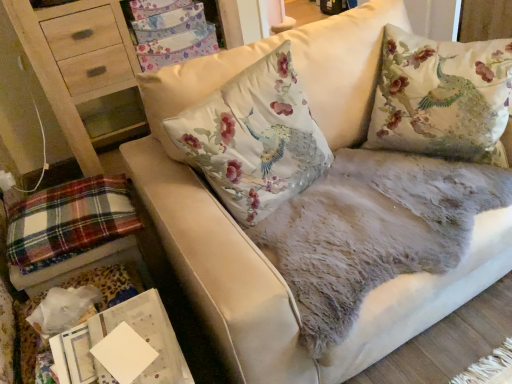
At what (x,y) coordinates should I click in order to perform the action: click on floral fabric cushion at upper right. Please return your answer as a coordinate pair (x, y). Looking at the image, I should click on (81, 72).

The height and width of the screenshot is (384, 512). What do you see at coordinates (442, 97) in the screenshot?
I see `silky floral pillow at upper right, the first pillow positioned from the right` at bounding box center [442, 97].

Image resolution: width=512 pixels, height=384 pixels. I want to click on floral fabric cushion at center, positioned as the second pillow in right-to-left order, so click(255, 138).

Where is `floral fabric cushion at upper right`? This screenshot has width=512, height=384. floral fabric cushion at upper right is located at coordinates (81, 72).

Measure the distance from silky floral pillow at upper right, the 2th pillow when ordered from left to right, to white paper at lower left.

silky floral pillow at upper right, the 2th pillow when ordered from left to right, is 1.05 meters from white paper at lower left.

Can you tell me how much silky floral pillow at upper right, the 2th pillow when ordered from left to right, and white paper at lower left differ in facing direction?

There is a 150-degree angle between the facing directions of silky floral pillow at upper right, the 2th pillow when ordered from left to right, and white paper at lower left.

Based on the photo, looking at their sizes, would you say silky floral pillow at upper right, the 2th pillow when ordered from left to right, is wider or thinner than white paper at lower left?

silky floral pillow at upper right, the 2th pillow when ordered from left to right, is wider than white paper at lower left.

Considering the positions of points (426, 63) and (166, 343), is point (426, 63) closer to camera compared to point (166, 343)?

No, it is behind (166, 343).

Does plaid fabric at lower left turn towards silky floral pillow at upper right, the 2th pillow when ordered from left to right?

Yes, plaid fabric at lower left is facing silky floral pillow at upper right, the 2th pillow when ordered from left to right.

From a real-world perspective, is plaid fabric at lower left positioned over silky floral pillow at upper right, the first pillow positioned from the right, based on gravity?

No.

Between plaid fabric at lower left and silky floral pillow at upper right, the first pillow positioned from the right, which one appears on the left side from the viewer's perspective?

plaid fabric at lower left is more to the left.

How much distance is there between plaid fabric at lower left and silky floral pillow at upper right, the first pillow positioned from the right?

plaid fabric at lower left and silky floral pillow at upper right, the first pillow positioned from the right, are 3.49 feet apart from each other.

Consider the image. Considering the sizes of floral fabric cushion at upper right and plaid fabric at lower left in the image, is floral fabric cushion at upper right wider or thinner than plaid fabric at lower left?

In the image, floral fabric cushion at upper right appears to be more narrow than plaid fabric at lower left.

Is floral fabric cushion at upper right next to plaid fabric at lower left?

floral fabric cushion at upper right and plaid fabric at lower left are clearly separated.

Is floral fabric cushion at upper right facing away from plaid fabric at lower left?

floral fabric cushion at upper right is not turned away from plaid fabric at lower left.

Can we say plaid fabric at lower left lies outside white paper at lower left?

That's correct, plaid fabric at lower left is outside of white paper at lower left.

Which of these two, plaid fabric at lower left or white paper at lower left, is bigger?

plaid fabric at lower left is bigger.

Would you consider plaid fabric at lower left to be distant from white paper at lower left?

That's not correct — plaid fabric at lower left is a little close to white paper at lower left.

How distant is floral fabric cushion at center, the 1th pillow when ordered from left to right, from silky floral pillow at upper right, the 2th pillow when ordered from left to right?

They are 17.19 inches apart.

From the picture: Which of these two, floral fabric cushion at center, positioned as the second pillow in right-to-left order, or silky floral pillow at upper right, the first pillow positioned from the right, is wider?

Wider between the two is silky floral pillow at upper right, the first pillow positioned from the right.

From the image's perspective, is floral fabric cushion at center, the 1th pillow when ordered from left to right, beneath silky floral pillow at upper right, the first pillow positioned from the right?

Indeed, from the image's perspective, floral fabric cushion at center, the 1th pillow when ordered from left to right, is shown beneath silky floral pillow at upper right, the first pillow positioned from the right.

Based on the photo, which is more to the left, floral fabric cushion at center, positioned as the second pillow in right-to-left order, or silky floral pillow at upper right, the first pillow positioned from the right?

floral fabric cushion at center, positioned as the second pillow in right-to-left order.

Is silky floral pillow at upper right, the 2th pillow when ordered from left to right, aimed at floral fabric cushion at upper right?

No, silky floral pillow at upper right, the 2th pillow when ordered from left to right, does not turn towards floral fabric cushion at upper right.

Between silky floral pillow at upper right, the 2th pillow when ordered from left to right, and floral fabric cushion at upper right, which one appears on the left side from the viewer's perspective?

floral fabric cushion at upper right is more to the left.

Measure the distance from silky floral pillow at upper right, the first pillow positioned from the right, to floral fabric cushion at upper right.

They are 4.64 feet apart.

Is silky floral pillow at upper right, the 2th pillow when ordered from left to right, closer to camera compared to floral fabric cushion at upper right?

Yes, the depth of silky floral pillow at upper right, the 2th pillow when ordered from left to right, is less than that of floral fabric cushion at upper right.

In the scene shown: Which object is thinner, floral fabric cushion at upper right or white paper at lower left?

white paper at lower left is thinner.

What's the angular difference between floral fabric cushion at upper right and white paper at lower left's facing directions?

The angular difference between floral fabric cushion at upper right and white paper at lower left is 90.2 degrees.

Is there a large distance between floral fabric cushion at upper right and white paper at lower left?

Yes, floral fabric cushion at upper right is far from white paper at lower left.

From a real-world perspective, is floral fabric cushion at upper right under white paper at lower left?

No.

At what (x,y) coordinates should I click in order to perform the action: click on pillow that is the 2nd object to the right of the white paper at lower left, starting at the anchor. Please return your answer as a coordinate pair (x, y). Image resolution: width=512 pixels, height=384 pixels. Looking at the image, I should click on (442, 97).

From the image's perspective, starting from the plaid fabric at lower left, which pillow is the 2nd one above? Please provide its 2D coordinates.

[(442, 97)]

Based on their spatial positions, is plaid fabric at lower left or floral fabric cushion at upper right closer to floral fabric cushion at center, the 1th pillow when ordered from left to right?

plaid fabric at lower left lies closer to floral fabric cushion at center, the 1th pillow when ordered from left to right, than the other object.

Considering their positions, is plaid fabric at lower left positioned further to white paper at lower left than floral fabric cushion at upper right?

floral fabric cushion at upper right is positioned further to the anchor white paper at lower left.

Based on their spatial positions, is floral fabric cushion at center, positioned as the second pillow in right-to-left order, or silky floral pillow at upper right, the 2th pillow when ordered from left to right, closer to white paper at lower left?

floral fabric cushion at center, positioned as the second pillow in right-to-left order, is closer to white paper at lower left.

When comparing their distances from white paper at lower left, does silky floral pillow at upper right, the first pillow positioned from the right, or floral fabric cushion at upper right seem further?

Among the two, floral fabric cushion at upper right is located further to white paper at lower left.

Considering their positions, is white paper at lower left positioned closer to plaid fabric at lower left than floral fabric cushion at center, the 1th pillow when ordered from left to right?

The object closer to plaid fabric at lower left is white paper at lower left.

When comparing their distances from plaid fabric at lower left, does floral fabric cushion at center, positioned as the second pillow in right-to-left order, or floral fabric cushion at upper right seem closer?

The object closer to plaid fabric at lower left is floral fabric cushion at center, positioned as the second pillow in right-to-left order.

Based on their spatial positions, is plaid fabric at lower left or white paper at lower left further from floral fabric cushion at center, positioned as the second pillow in right-to-left order?

white paper at lower left is further to floral fabric cushion at center, positioned as the second pillow in right-to-left order.

Considering their positions, is white paper at lower left positioned further to floral fabric cushion at center, the 1th pillow when ordered from left to right, than floral fabric cushion at upper right?

floral fabric cushion at upper right.

I want to click on pillow between plaid fabric at lower left and silky floral pillow at upper right, the 2th pillow when ordered from left to right, so click(255, 138).

You are a GUI agent. You are given a task and a screenshot of the screen. Output one action in this format:
    pyautogui.click(x=<x>, y=<y>)
    Task: Click on the plaid between floral fabric cushion at upper right and white paper at lower left in the vertical direction
    
    Given the screenshot: What is the action you would take?
    pyautogui.click(x=69, y=221)

Locate an element on the screen. pillow located between floral fabric cushion at upper right and silky floral pillow at upper right, the 2th pillow when ordered from left to right, in the left-right direction is located at coordinates (255, 138).

In order to click on pillow between white paper at lower left and silky floral pillow at upper right, the 2th pillow when ordered from left to right, from left to right in this screenshot , I will do `click(255, 138)`.